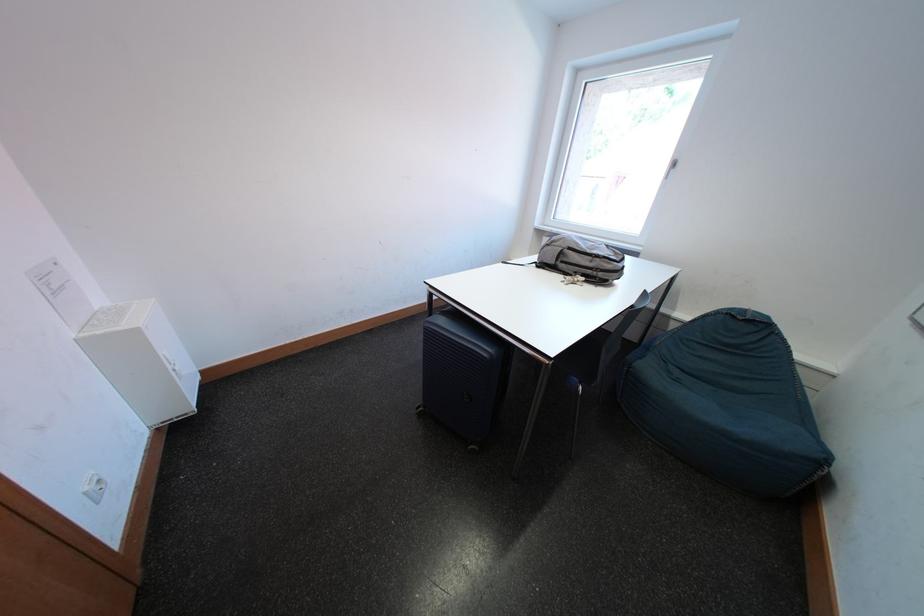
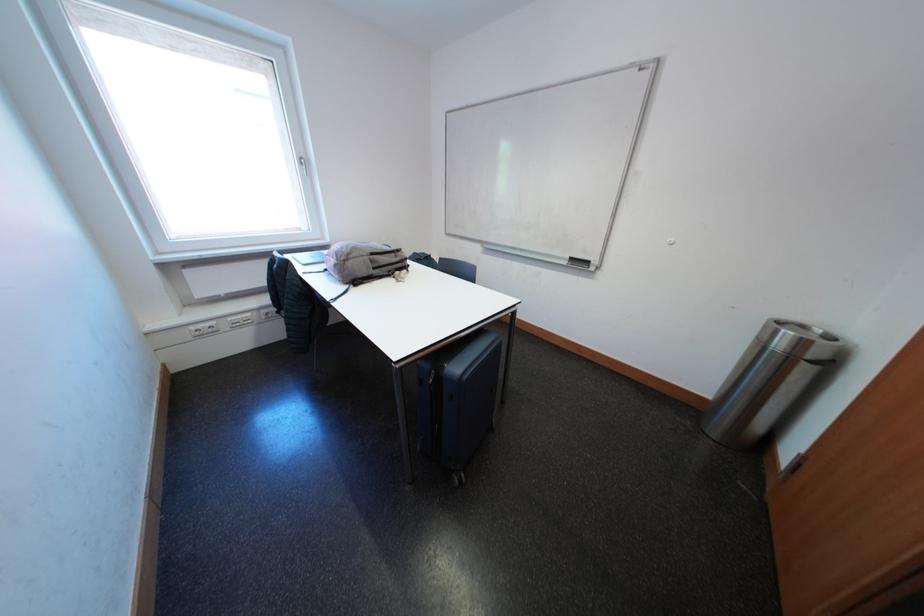
The point at (601, 265) is marked in the first image. Where is the corresponding point in the second image?

(406, 261)